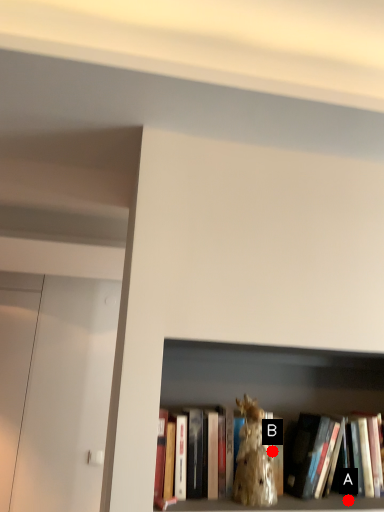
Question: Two points are circled on the image, labeled by A and B beside each circle. Which point is farther from the camera taking this photo?

Choices:
 (A) A is further
 (B) B is further

Answer: (A)